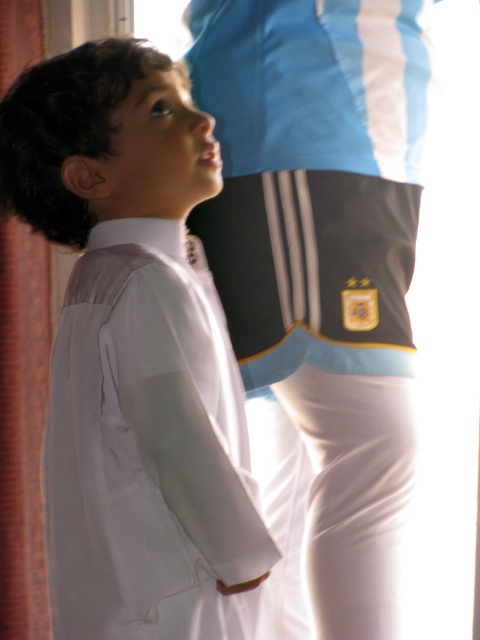
Question: From the image, what is the correct spatial relationship of white smooth shirt at center in relation to blue/white striped jersey at upper center?

Choices:
 (A) below
 (B) above

Answer: (A)

Question: Among these points, which one is farthest from the camera?

Choices:
 (A) (71, 88)
 (B) (33, 412)

Answer: (B)

Question: Which point is closer to the camera?

Choices:
 (A) pyautogui.click(x=369, y=630)
 (B) pyautogui.click(x=12, y=605)

Answer: (A)

Question: Among these objects, which one is nearest to the camera?

Choices:
 (A) brown fabric curtain at left
 (B) blue/white striped jersey at upper center

Answer: (B)

Question: Is white smooth shirt at center smaller than brown fabric curtain at left?

Choices:
 (A) no
 (B) yes

Answer: (A)

Question: Does white smooth shirt at center have a greater width compared to blue/white striped jersey at upper center?

Choices:
 (A) yes
 (B) no

Answer: (A)